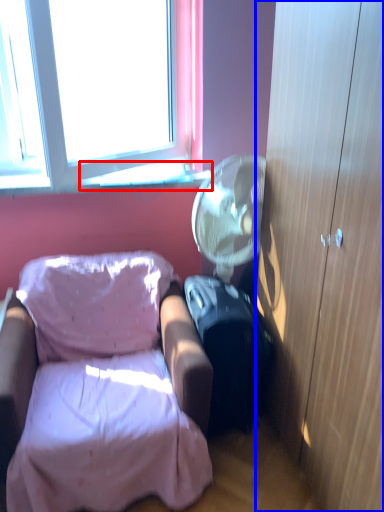
Question: Which of the following is the farthest to the observer, window sill (highlighted by a red box) or cabinetry (highlighted by a blue box)?

Choices:
 (A) window sill
 (B) cabinetry

Answer: (A)